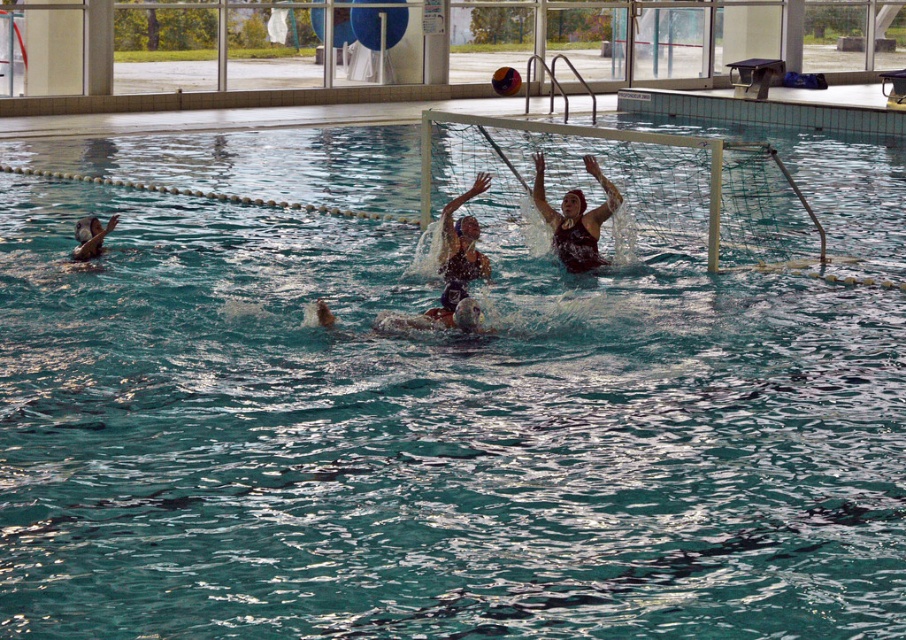
Looking at this image, you are a photographer standing at the edge of the pool. You want to take a photo of the point at coordinates (564,262) in the image. If your camera has a maximum zoom range of 50 feet, will you be able to capture the point clearly?

The point at coordinates (564,262) is 46.45 feet from the camera. Since 46.45 feet is within the camera maximum zoom range of 50 feet, the photographer can capture the point clearly.

You are a water polo referee observing the game. There is a point marked at coordinates (576, 218) in the image. Which player is located at this point?

The point at (576, 218) indicates the dark brown swimsuit at upper center.

You are a spectator at the water polo match. You notice two players in the pool. One is wearing a dark brown swimsuit at upper center and the other has a smooth skin face at lower left. From your viewpoint, which player is positioned higher in the image?

The dark brown swimsuit at upper center is positioned higher than the smooth skin face at lower left in the image.